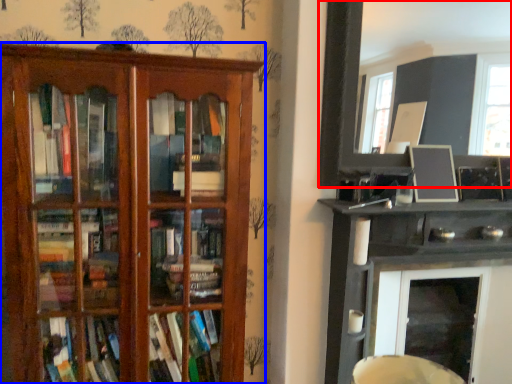
Question: Which of the following is the closest to the observer, picture frame (highlighted by a red box) or shelf (highlighted by a blue box)?

Choices:
 (A) picture frame
 (B) shelf

Answer: (B)